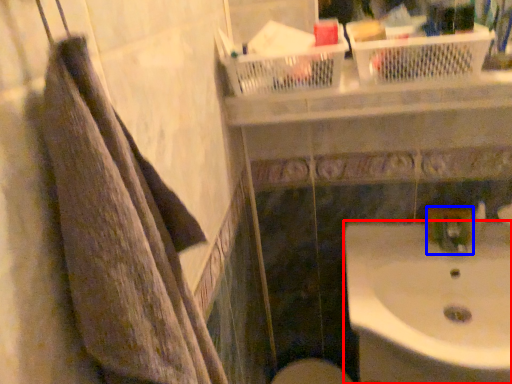
Question: Which point is closer to the camera, sink (highlighted by a red box) or plumbing fixture (highlighted by a blue box)?

Choices:
 (A) sink
 (B) plumbing fixture

Answer: (A)